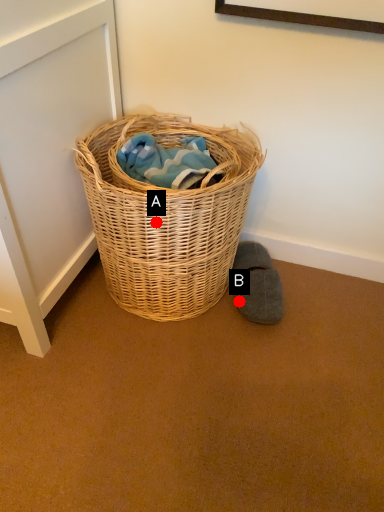
Question: Two points are circled on the image, labeled by A and B beside each circle. Which point appears farthest from the camera in this image?

Choices:
 (A) A is further
 (B) B is further

Answer: (B)